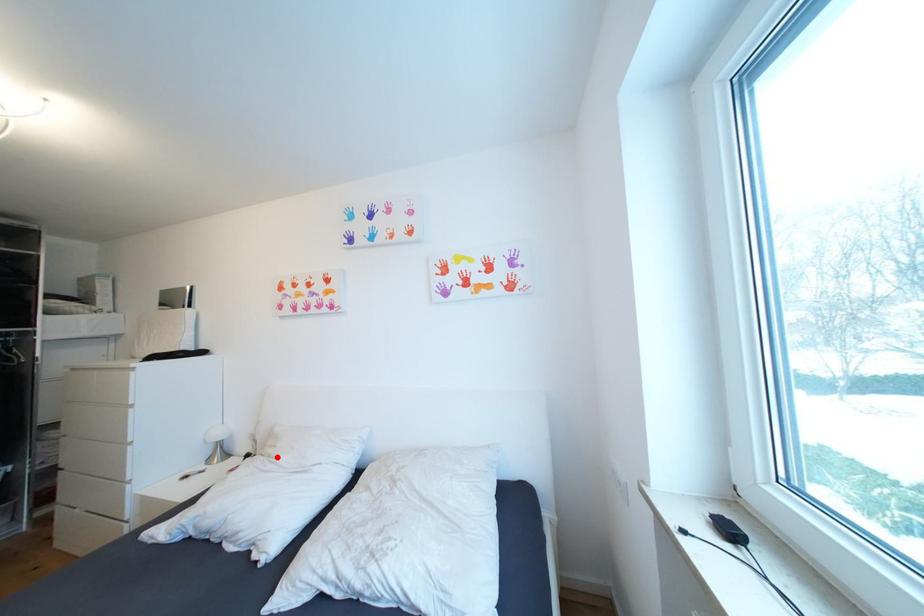
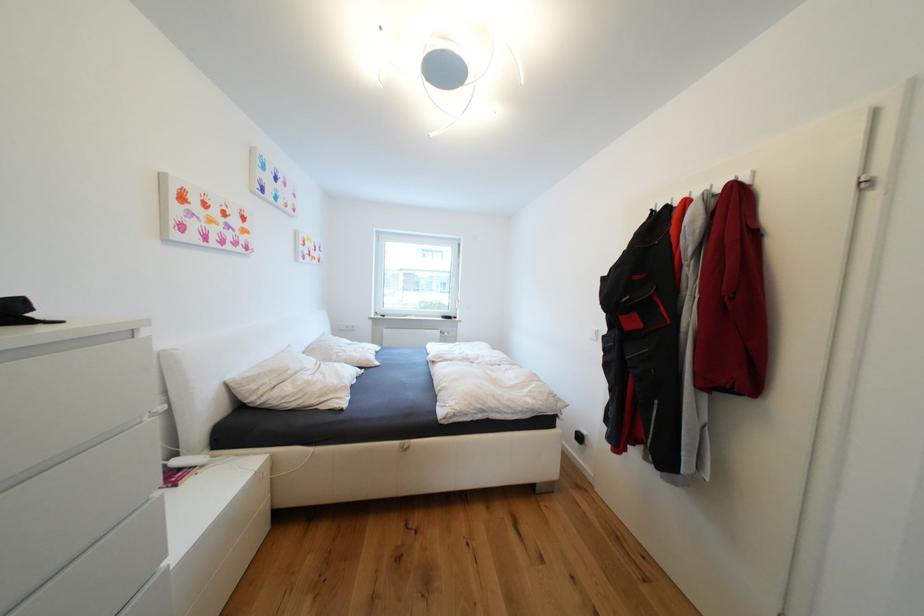
Question: I am providing you with two images of the same scene from different viewpoints. A red point is shown in image1. For the corresponding object point in image2, is it positioned nearer or farther from the camera?

Choices:
 (A) Nearer
 (B) Farther

Answer: (A)